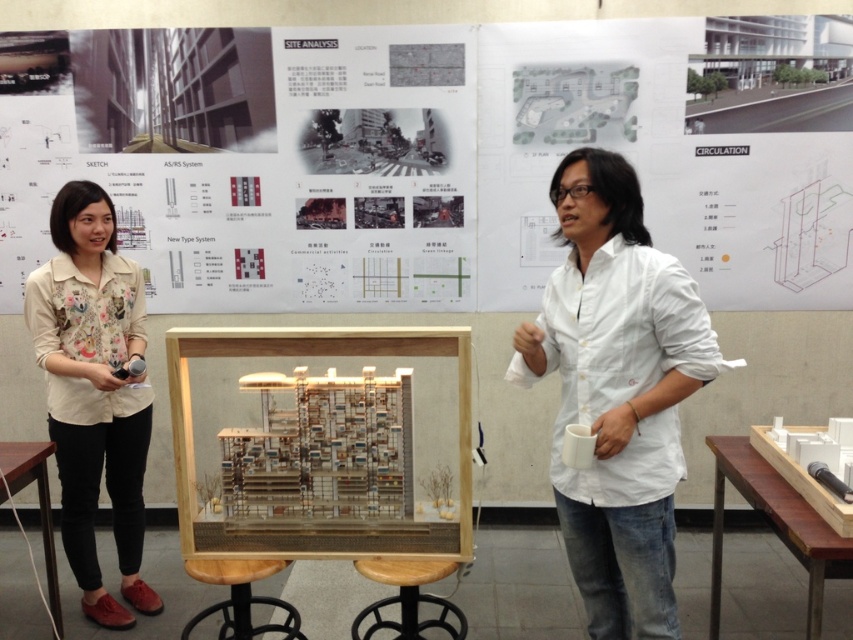
You are an attendee at this presentation and want to see both the white paper poster at upper center and the white matte shirt at center clearly. Which one is easier to see from your current position?

The white paper poster at upper center is easier to see because it has a larger size compared to the white matte shirt at center.